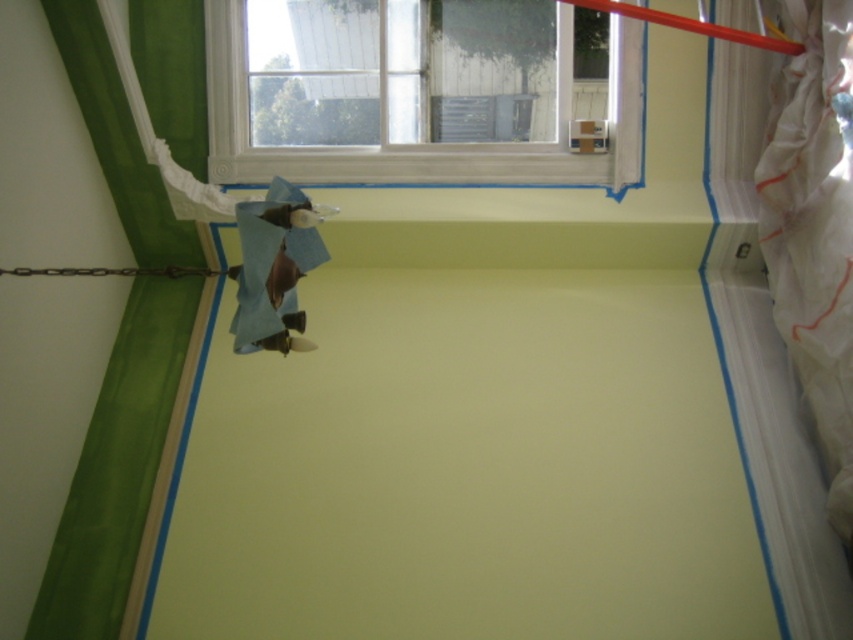
Which is in front, point (393, 104) or point (779, 164)?

Point (779, 164) is more forward.

From the picture: Between white painted wood window at upper center and white plastic curtain at right, which one appears on the right side from the viewer's perspective?

white plastic curtain at right

At what (x,y) coordinates should I click in order to perform the action: click on white painted wood window at upper center. Please return your answer as a coordinate pair (x, y). The width and height of the screenshot is (853, 640). Looking at the image, I should click on (413, 93).

Where is `white painted wood window at upper center`? This screenshot has width=853, height=640. white painted wood window at upper center is located at coordinates (413, 93).